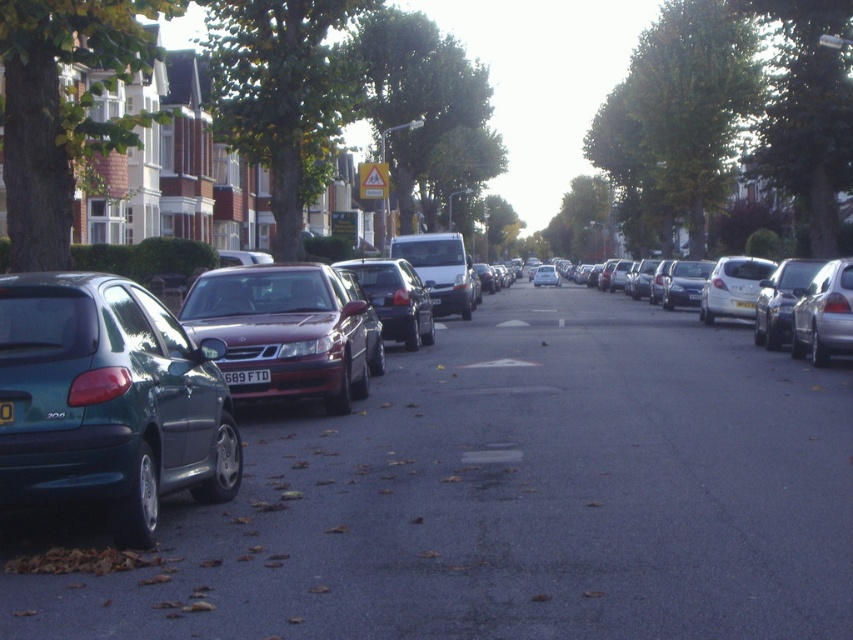
You are a delivery driver who needs to park your van between the teal glossy hatchback at left and the satin red sedan at center. Your van is 4.5 meters long. Can you fit your van between them without moving either car?

The distance between the teal glossy hatchback at left and the satin red sedan at center is 4.25 meters, which is shorter than your van length of 4.5 meters. Therefore, you cannot fit your van between them without moving either car.

You are a delivery driver who needs to park your teal glossy hatchback at left in a space that can accommodate its height. There is a shiny silver sedan at right parked nearby. Which vehicle should you choose to park next to for better visibility of the road?

The teal glossy hatchback at left has a lesser height compared to the shiny silver sedan at right. Therefore, parking next to the shiny silver sedan at right would provide better visibility of the road since it is taller and might block less of the driver s view.

You are a delivery driver who needs to park your teal glossy hatchback at left in a spot that is 5.62 meters away from the curb. Is the parking space available at that distance sufficient for your vehicle?

The teal glossy hatchback at left is 5.62 meters away from the curb, so the parking space available at that distance is sufficient for the vehicle.